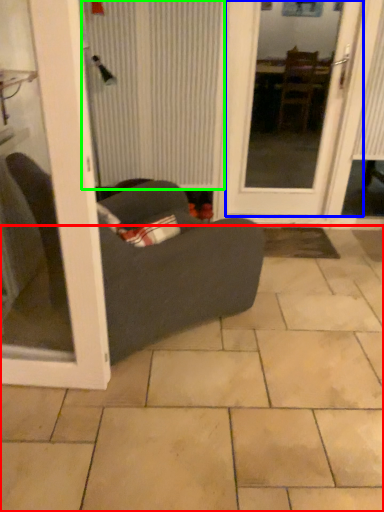
Question: Estimate the real-world distances between objects in this image. Which object is closer to ceramic tile (highlighted by a red box), door (highlighted by a blue box) or curtain (highlighted by a green box)?

Choices:
 (A) door
 (B) curtain

Answer: (B)